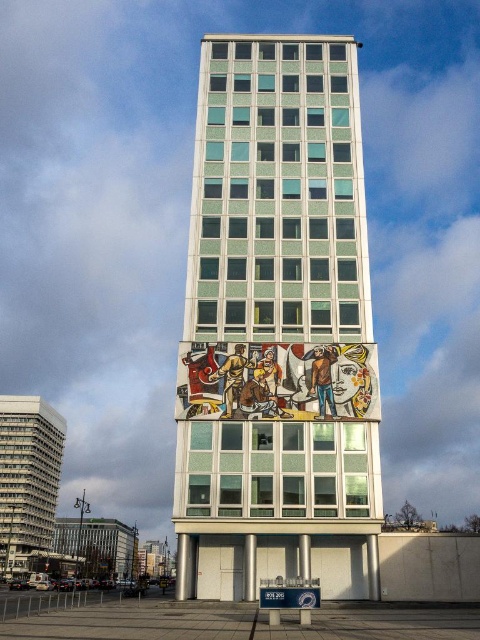
Question: Is white glossy building at center to the left of matte gray building at left from the viewer's perspective?

Choices:
 (A) yes
 (B) no

Answer: (B)

Question: Does white glossy building at center appear on the right side of matte gray building at left?

Choices:
 (A) no
 (B) yes

Answer: (B)

Question: Does white glossy building at center have a larger size compared to matte gray building at left?

Choices:
 (A) yes
 (B) no

Answer: (B)

Question: Which point is farther to the camera?

Choices:
 (A) white glossy building at center
 (B) matte gray building at left

Answer: (B)

Question: Which of the following is the farthest from the observer?

Choices:
 (A) white glossy building at center
 (B) matte gray building at left

Answer: (B)